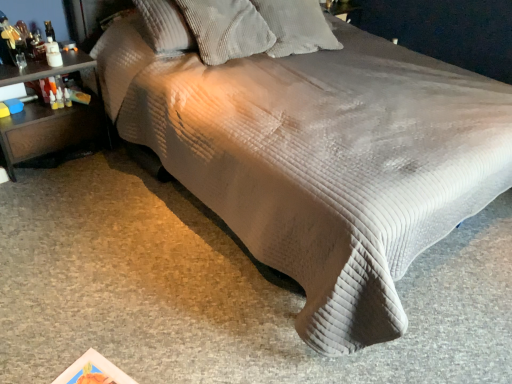
Question: Which direction should I rotate to look at corduroy pillow at upper center, positioned as the first pillow in left-to-right order, — up or down?

Choices:
 (A) down
 (B) up

Answer: (B)

Question: Would you say brown wood nightstand at left is outside white corduroy pillow at upper center, marked as the second pillow in a left-to-right arrangement?

Choices:
 (A) no
 (B) yes

Answer: (B)

Question: Considering the relative sizes of brown wood nightstand at left and white corduroy pillow at upper center, marked as the second pillow in a left-to-right arrangement, in the image provided, is brown wood nightstand at left bigger than white corduroy pillow at upper center, marked as the second pillow in a left-to-right arrangement,?

Choices:
 (A) no
 (B) yes

Answer: (B)

Question: Does brown wood nightstand at left have a lesser height compared to white corduroy pillow at upper center, marked as the second pillow in a left-to-right arrangement?

Choices:
 (A) no
 (B) yes

Answer: (A)

Question: Does brown wood nightstand at left appear on the left side of white corduroy pillow at upper center, which is counted as the 1th pillow, starting from the right?

Choices:
 (A) no
 (B) yes

Answer: (B)

Question: From the image's perspective, is brown wood nightstand at left located above white corduroy pillow at upper center, marked as the second pillow in a left-to-right arrangement?

Choices:
 (A) yes
 (B) no

Answer: (B)

Question: Considering the relative sizes of brown wood nightstand at left and white corduroy pillow at upper center, which is counted as the 1th pillow, starting from the right, in the image provided, is brown wood nightstand at left thinner than white corduroy pillow at upper center, which is counted as the 1th pillow, starting from the right,?

Choices:
 (A) no
 (B) yes

Answer: (B)

Question: Is corduroy pillow at upper center, the second pillow from the right, at the right side of brown wood nightstand at left?

Choices:
 (A) no
 (B) yes

Answer: (B)

Question: Is corduroy pillow at upper center, the second pillow from the right, at the left side of brown wood nightstand at left?

Choices:
 (A) no
 (B) yes

Answer: (A)

Question: From a real-world perspective, is corduroy pillow at upper center, positioned as the first pillow in left-to-right order, on brown wood nightstand at left?

Choices:
 (A) no
 (B) yes

Answer: (B)

Question: From the image's perspective, is corduroy pillow at upper center, positioned as the first pillow in left-to-right order, located above brown wood nightstand at left?

Choices:
 (A) no
 (B) yes

Answer: (B)

Question: From the image's perspective, does corduroy pillow at upper center, positioned as the first pillow in left-to-right order, appear lower than brown wood nightstand at left?

Choices:
 (A) yes
 (B) no

Answer: (B)

Question: Is the depth of corduroy pillow at upper center, positioned as the first pillow in left-to-right order, greater than that of brown wood nightstand at left?

Choices:
 (A) no
 (B) yes

Answer: (B)

Question: Could you tell me if white corduroy pillow at upper center, which is counted as the 1th pillow, starting from the right, is turned towards brown wood nightstand at left?

Choices:
 (A) no
 (B) yes

Answer: (A)